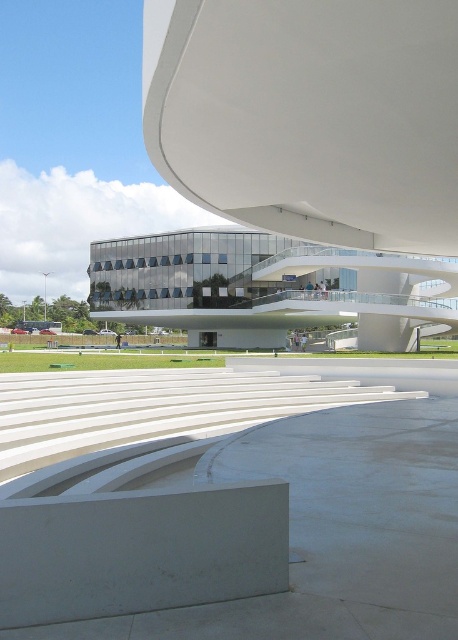
Does point (287, 86) lie in front of point (310, 310)?

Yes.

Who is positioned more to the right, white smooth amphitheater at center or transparent glass building at center?

Positioned to the right is white smooth amphitheater at center.

Who is more distant from viewer, [165,144] or [255,248]?

The point [255,248] is behind.

The image size is (458, 640). I want to click on white smooth amphitheater at center, so click(x=295, y=170).